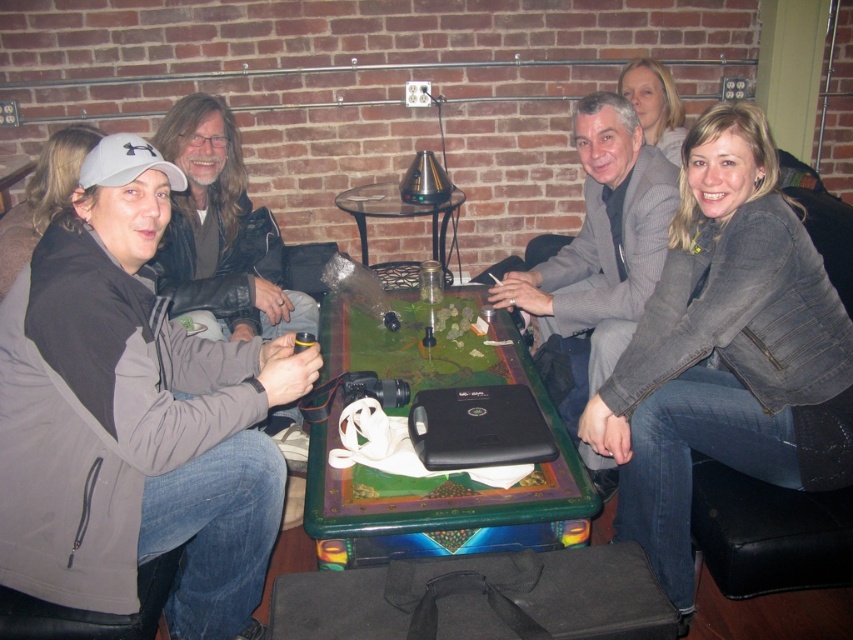
You are at a bar and want to place your drink on the translucent glass table at center without it blocking the view of the blonde hair at upper right. Is the table positioned in a way that allows this?

The translucent glass table at center is located below blonde hair at upper right, so placing your drink there would not block the view of the blonde hair at upper right since the table is positioned beneath it.

From the picture: You are standing at the entrance of the room and see the black matte laptop at center on the table. If you walk straight towards the table, will the laptop be directly in front of you?

The black matte laptop at center is located at point (479, 428), which means it is positioned slightly to the right and forward on the table. Since you are walking straight towards the table, the laptop will be to your right side, not directly in front of you.

You are standing at the point labeled as point (439,248) in the image. Looking towards the table, can you see the point labeled point (427,396) directly in front of you?

Yes, point (427,396) is in front of point (439,248), so you can see it directly in front of you.